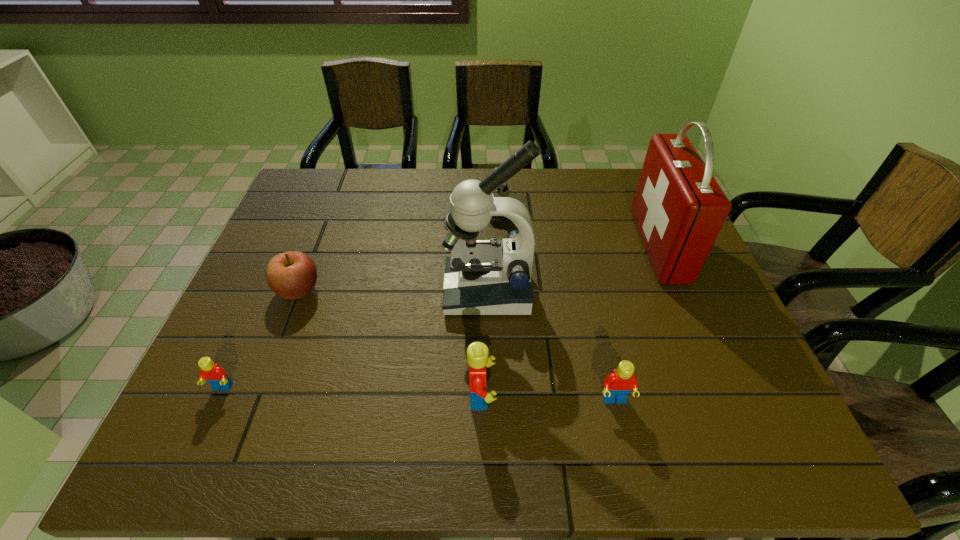
Image resolution: width=960 pixels, height=540 pixels. Identify the location of apple at the left edge. (291, 275).

I want to click on object at the right edge, so click(679, 208).

Find the location of a particular element. Image resolution: width=960 pixels, height=540 pixels. object that is at the near left corner is located at coordinates (215, 375).

Image resolution: width=960 pixels, height=540 pixels. What are the coordinates of `object that is positioned at the far right corner` in the screenshot? It's located at (679, 208).

In the image, there is a desktop. Identify the location of blank space at the far edge. (439, 173).

The image size is (960, 540). Find the location of `vacant space at the left edge`. vacant space at the left edge is located at coordinates (264, 314).

Where is `free space at the far left corner of the desktop`? free space at the far left corner of the desktop is located at coordinates (337, 200).

In the image, there is a desktop. Identify the location of vacant space at the far right corner. (636, 185).

Where is `vacant area that lies between the first-aid kit and the microphone`? The height and width of the screenshot is (540, 960). vacant area that lies between the first-aid kit and the microphone is located at coordinates tap(569, 230).

Image resolution: width=960 pixels, height=540 pixels. What are the coordinates of `empty space between the apple and the leftmost Lego` in the screenshot? It's located at (260, 339).